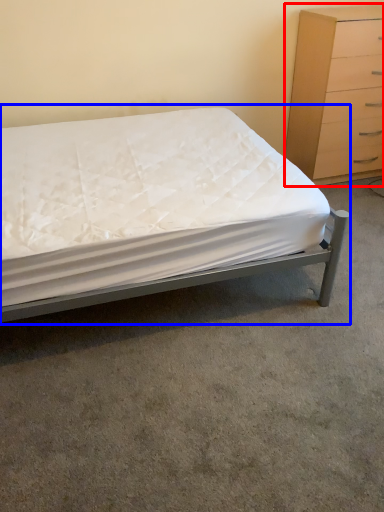
Question: Which object is further to the camera taking this photo, chest of drawers (highlighted by a red box) or bed (highlighted by a blue box)?

Choices:
 (A) chest of drawers
 (B) bed

Answer: (A)